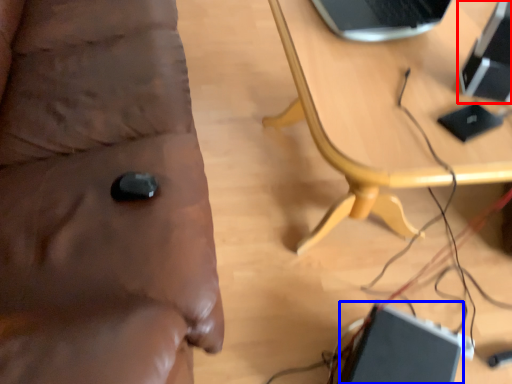
Question: Among these objects, which one is nearest to the camera, computer (highlighted by a red box) or laptop (highlighted by a blue box)?

Choices:
 (A) computer
 (B) laptop

Answer: (A)